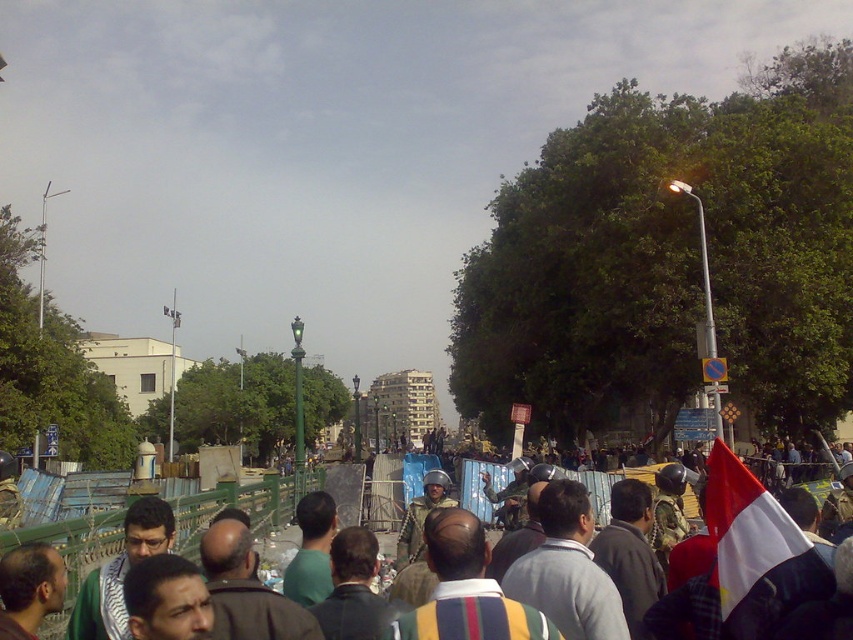
Who is more distant from viewer, (177, 508) or (171, 323)?

Point (171, 323)

Is point (500, 474) closer to camera compared to point (173, 316)?

Yes, point (500, 474) is in front of point (173, 316).

Identify the location of striped shirt at center. This screenshot has height=640, width=853. (70, 552).

Who is more distant from viewer, (747, 586) or (177, 310)?

Positioned behind is point (177, 310).

Which is more to the left, white fabric flag at right or white fabric flag at upper center?

white fabric flag at upper center

Does point (744, 516) come farther from viewer compared to point (177, 324)?

No, (744, 516) is closer to viewer.

Locate an element on the screen. white fabric flag at right is located at coordinates (744, 525).

Who is shorter, striped shirt at center or white fabric flag at right?

white fabric flag at right

Is striped shirt at center in front of white fabric flag at right?

No, striped shirt at center is behind white fabric flag at right.

Describe the element at coordinates (70, 552) in the screenshot. I see `striped shirt at center` at that location.

Find the location of a particular element. This screenshot has width=853, height=640. striped shirt at center is located at coordinates (70, 552).